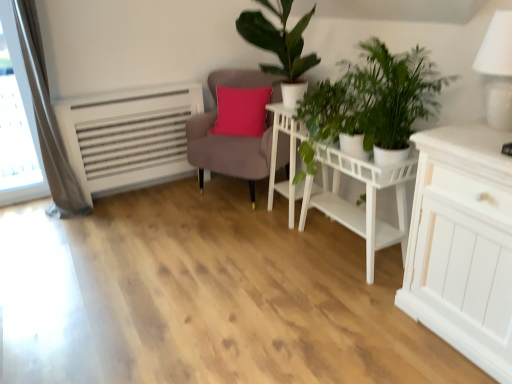
This screenshot has width=512, height=384. In order to click on vacant area situated below white matte table at center (from a real-world perspective) in this screenshot , I will do `click(345, 245)`.